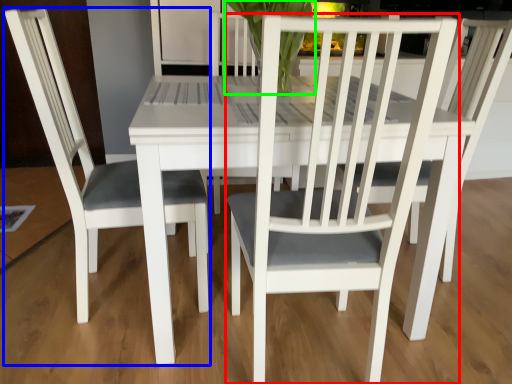
Question: Considering the real-world distances, which object is farthest from chair (highlighted by a red box)? chair (highlighted by a blue box) or orchid (highlighted by a green box)?

Choices:
 (A) chair
 (B) orchid

Answer: (B)